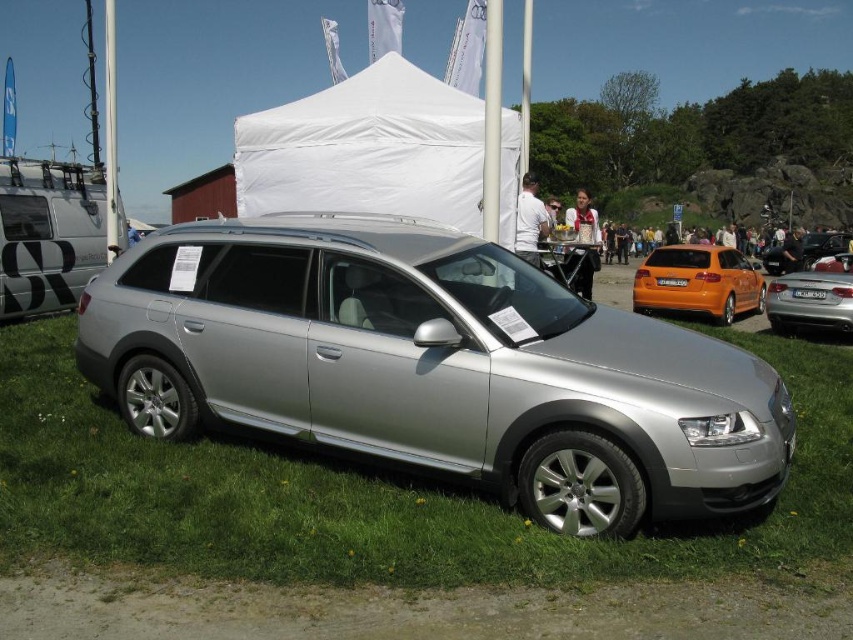
You are standing in front of the silver Audi Allroad at the car show. There are two points marked on the car, one at point coordinates (335, 148) and the other at (804, 305). Which point is nearer to your current position?

Point (335, 148) is closer to the camera than point (804, 305), so the point at coordinates (335, 148) is nearer to your current position.

You are standing at the center of the image. There is a silver metallic sedan at right located at point (809, 301). Which direction should you walk to reach the silver metallic sedan at right?

The silver metallic sedan at right is located at point (809, 301), so you should walk towards the right side of the image to reach it.

What object is located at the coordinates point (434,365) in the image?

The point (434,365) corresponds to the satin silver wagon at center.